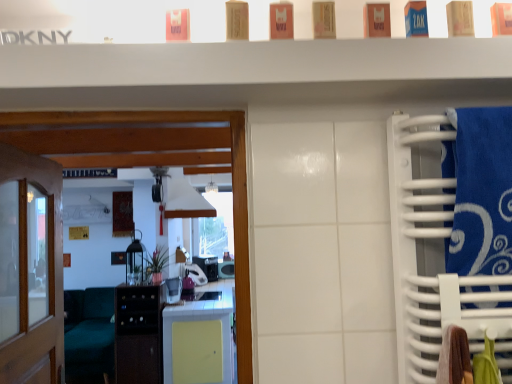
Question: Is blue fabric towel at right not within purple plastic toaster at center, which is the third appliance from back to front?

Choices:
 (A) yes
 (B) no

Answer: (A)

Question: Is blue fabric towel at right oriented towards purple plastic toaster at center, which ranks as the third appliance in front-to-back order?

Choices:
 (A) yes
 (B) no

Answer: (B)

Question: Does blue fabric towel at right appear on the right side of purple plastic toaster at center, which is the third appliance from back to front?

Choices:
 (A) no
 (B) yes

Answer: (B)

Question: From the image's perspective, does blue fabric towel at right appear lower than purple plastic toaster at center, which is the third appliance from back to front?

Choices:
 (A) no
 (B) yes

Answer: (A)

Question: Does blue fabric towel at right have a larger size compared to purple plastic toaster at center, which ranks as the third appliance in front-to-back order?

Choices:
 (A) no
 (B) yes

Answer: (A)

Question: Is point (172, 296) closer or farther from the camera than point (198, 259)?

Choices:
 (A) closer
 (B) farther

Answer: (A)

Question: Choose the correct answer: Is white glossy microwave at center, the first appliance when ordered from front to back, inside black plastic toaster at center, acting as the 2th appliance starting from the back, or outside it?

Choices:
 (A) outside
 (B) inside

Answer: (A)

Question: From a real-world perspective, is white glossy microwave at center, placed as the 5th appliance when sorted from back to front, positioned above or below black plastic toaster at center, placed as the fourth appliance when sorted from front to back?

Choices:
 (A) above
 (B) below

Answer: (B)

Question: In the image, is white glossy microwave at center, placed as the 5th appliance when sorted from back to front, on the left side or the right side of black plastic toaster at center, placed as the fourth appliance when sorted from front to back?

Choices:
 (A) right
 (B) left

Answer: (B)

Question: Visually, is black plastic toaster at center, placed as the fourth appliance when sorted from front to back, positioned to the left or to the right of white matte exhaust hood at center?

Choices:
 (A) left
 (B) right

Answer: (B)

Question: From the image's perspective, is black plastic toaster at center, placed as the fourth appliance when sorted from front to back, above or below white matte exhaust hood at center?

Choices:
 (A) below
 (B) above

Answer: (A)

Question: Looking at the image, does black plastic toaster at center, placed as the fourth appliance when sorted from front to back, seem bigger or smaller compared to white matte exhaust hood at center?

Choices:
 (A) small
 (B) big

Answer: (A)

Question: Relative to white matte exhaust hood at center, is black plastic toaster at center, acting as the 2th appliance starting from the back, in front or behind?

Choices:
 (A) behind
 (B) front

Answer: (A)

Question: Does point (130, 269) appear closer or farther from the camera than point (201, 269)?

Choices:
 (A) farther
 (B) closer

Answer: (B)

Question: From the image's perspective, relative to purple plastic toaster at center, which ranks as the third appliance in front-to-back order, is matte black lantern at center, which ranks as the fourth appliance in back-to-front order, above or below?

Choices:
 (A) above
 (B) below

Answer: (A)